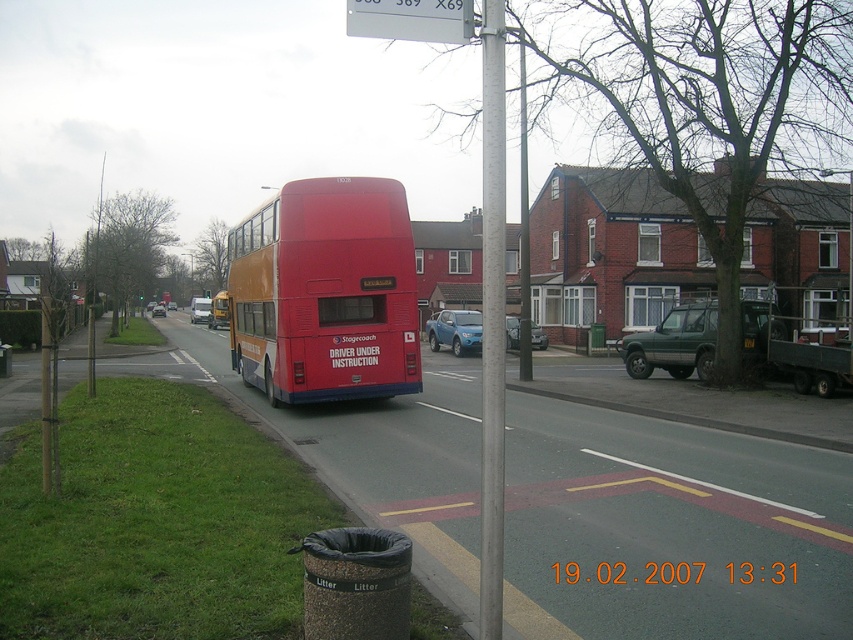
You are a pedestrian standing at the edge of the sidewalk where the matte red bus at center is parked. You need to reach the white plastic sign at upper center to read its contents. Can you walk directly to the sign without going around the bus?

The distance between the matte red bus at center and the white plastic sign at upper center is 8.33 meters. Since the bus is parked at the edge of the sidewalk, there is enough space between them for you to walk directly to the sign without needing to go around the bus.

You are standing at the entrance of the street and want to locate the matte red bus at center. According to the coordinates provided, in which direction should you look to find it?

The matte red bus at center is located at coordinates point (325,292). Since the coordinate system typically places the origin at the bottom left corner, the bus is positioned slightly to the right and above the center point of the image. Therefore, you should look towards the central area of the image, slightly to the right and upward from the bottom left origin.

You are a delivery person trying to park a truck that is 3 meters wide. You see the matte red bus at center and the red matte bus at center in the image. Which bus should you avoid parking next to if you want to ensure there is enough space for your truck?

The red matte bus at center has a greater width than the matte red bus at center. Since your truck is 3 meters wide, you should avoid parking next to the red matte bus at center to ensure sufficient space.